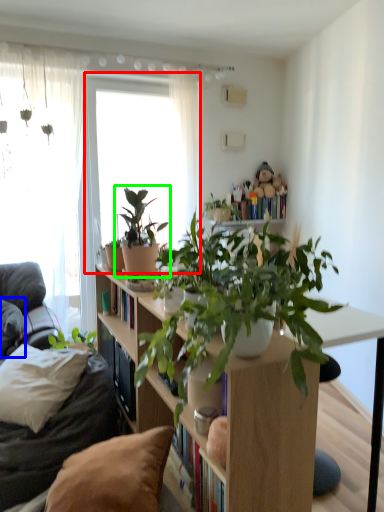
Question: Which is nearer to the window (highlighted by a red box)? pillow (highlighted by a blue box) or houseplant (highlighted by a green box).

Choices:
 (A) pillow
 (B) houseplant

Answer: (A)